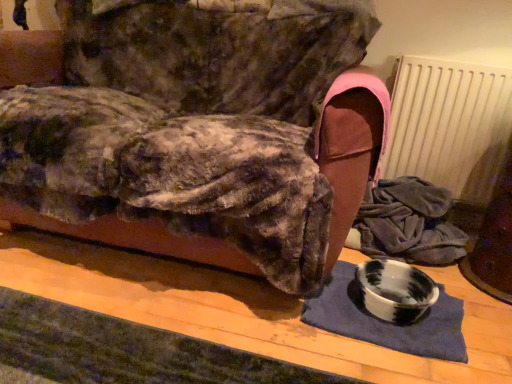
Describe the element at coordinates (449, 125) in the screenshot. This screenshot has width=512, height=384. I see `white matte radiator at upper right` at that location.

Measure the distance between marbled ceramic bowl at lower right and camera.

The distance of marbled ceramic bowl at lower right from camera is 1.26 meters.

Locate an element on the screen. The width and height of the screenshot is (512, 384). white matte radiator at upper right is located at coordinates (449, 125).

Is marbled ceramic bowl at lower right spatially inside white matte radiator at upper right, or outside of it?

marbled ceramic bowl at lower right cannot be found inside white matte radiator at upper right.

Could you tell me if marbled ceramic bowl at lower right is facing white matte radiator at upper right?

No, marbled ceramic bowl at lower right is not facing towards white matte radiator at upper right.

In the scene shown: Is marbled ceramic bowl at lower right closer to the viewer compared to white matte radiator at upper right?

Yes, marbled ceramic bowl at lower right is closer to the viewer.

Consider the image. Considering the relative sizes of marbled ceramic bowl at lower right and white matte radiator at upper right in the image provided, is marbled ceramic bowl at lower right shorter than white matte radiator at upper right?

Yes.

Is white matte radiator at upper right taller or shorter than marbled ceramic bowl at lower right?

Considering their sizes, white matte radiator at upper right has more height than marbled ceramic bowl at lower right.

Is white matte radiator at upper right thinner than marbled ceramic bowl at lower right?

Correct, the width of white matte radiator at upper right is less than that of marbled ceramic bowl at lower right.

Does point (420, 161) appear closer or farther from the camera than point (395, 273)?

Clearly, point (420, 161) is more distant from the camera than point (395, 273).

Could you tell me if white matte radiator at upper right is turned towards marbled ceramic bowl at lower right?

Yes, white matte radiator at upper right is aimed at marbled ceramic bowl at lower right.

Relative to white matte radiator at upper right, is marble bowl at lower right in front or behind?

Clearly, marble bowl at lower right is in front of white matte radiator at upper right.

Does marble bowl at lower right turn towards white matte radiator at upper right?

No, marble bowl at lower right is not facing towards white matte radiator at upper right.

There is a white matte radiator at upper right. Where is `furniture above it (from a real-world perspective)`? The height and width of the screenshot is (384, 512). furniture above it (from a real-world perspective) is located at coordinates (200, 130).

From a real-world perspective, is marble bowl at lower right located beneath white matte radiator at upper right?

No, from a real-world perspective, marble bowl at lower right is not under white matte radiator at upper right.

Is white matte radiator at upper right not within marble bowl at lower right?

white matte radiator at upper right lies outside marble bowl at lower right's area.

Considering the sizes of objects white matte radiator at upper right and marble bowl at lower right in the image provided, who is thinner, white matte radiator at upper right or marble bowl at lower right?

white matte radiator at upper right is thinner.

From the picture: From a real-world perspective, is white matte radiator at upper right below marble bowl at lower right?

Yes, from a real-world perspective, white matte radiator at upper right is below marble bowl at lower right.

From the image's perspective, relative to marble bowl at lower right, is white matte radiator at upper right above or below?

white matte radiator at upper right is below marble bowl at lower right.

Identify the location of bowl on the right of marble bowl at lower right. (395, 290).

Considering the positions of objects marbled ceramic bowl at lower right and marble bowl at lower right in the image provided, who is more to the left, marbled ceramic bowl at lower right or marble bowl at lower right?

marble bowl at lower right is more to the left.

Does marbled ceramic bowl at lower right have a greater height compared to marble bowl at lower right?

In fact, marbled ceramic bowl at lower right may be shorter than marble bowl at lower right.

From the image's perspective, is marbled ceramic bowl at lower right over marble bowl at lower right?

No, from the image's perspective, marbled ceramic bowl at lower right is not above marble bowl at lower right.

Is marble bowl at lower right completely or partially outside of marbled ceramic bowl at lower right?

marble bowl at lower right lies outside marbled ceramic bowl at lower right's area.

Where is `bowl below the marble bowl at lower right (from a real-world perspective)`? Image resolution: width=512 pixels, height=384 pixels. bowl below the marble bowl at lower right (from a real-world perspective) is located at coordinates (395, 290).

Which is closer, (230, 32) or (414, 270)?

Clearly, point (230, 32) is more distant from the camera than point (414, 270).

How different are the orientations of marble bowl at lower right and marbled ceramic bowl at lower right in degrees?

The facing directions of marble bowl at lower right and marbled ceramic bowl at lower right are 0.0148 degrees apart.

Find the location of `radiator positioned vertically above the marbled ceramic bowl at lower right (from a real-world perspective)`. radiator positioned vertically above the marbled ceramic bowl at lower right (from a real-world perspective) is located at coordinates (449, 125).

The width and height of the screenshot is (512, 384). In order to click on radiator located on the right of marbled ceramic bowl at lower right in this screenshot , I will do `click(449, 125)`.

Which object lies nearer to the anchor point marbled ceramic bowl at lower right, white matte radiator at upper right or marble bowl at lower right?

Based on the image, marble bowl at lower right appears to be nearer to marbled ceramic bowl at lower right.

Considering their positions, is white matte radiator at upper right positioned further to marble bowl at lower right than marbled ceramic bowl at lower right?

Based on the image, white matte radiator at upper right appears to be further to marble bowl at lower right.

Which object lies further to the anchor point white matte radiator at upper right, marbled ceramic bowl at lower right or marble bowl at lower right?

marble bowl at lower right is positioned further to the anchor white matte radiator at upper right.

Which object lies nearer to the anchor point white matte radiator at upper right, marble bowl at lower right or marbled ceramic bowl at lower right?

marbled ceramic bowl at lower right lies closer to white matte radiator at upper right than the other object.

When comparing their distances from marbled ceramic bowl at lower right, does marble bowl at lower right or white matte radiator at upper right seem closer?

Among the two, marble bowl at lower right is located nearer to marbled ceramic bowl at lower right.

When comparing their distances from marble bowl at lower right, does marbled ceramic bowl at lower right or white matte radiator at upper right seem closer?

marbled ceramic bowl at lower right is closer to marble bowl at lower right.

At what (x,y) coordinates should I click in order to perform the action: click on bowl situated between marble bowl at lower right and white matte radiator at upper right from left to right. Please return your answer as a coordinate pair (x, y). Looking at the image, I should click on (395, 290).